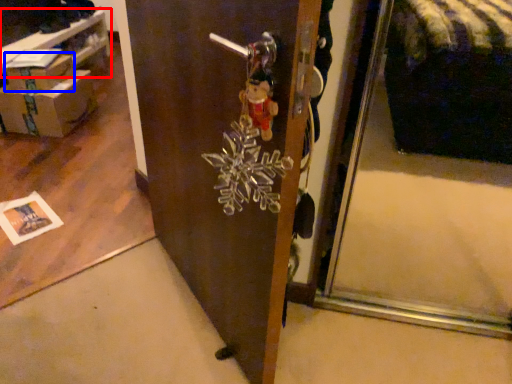
Question: Which point is closer to the camera, table (highlighted by a red box) or cardboard box (highlighted by a blue box)?

Choices:
 (A) table
 (B) cardboard box

Answer: (A)